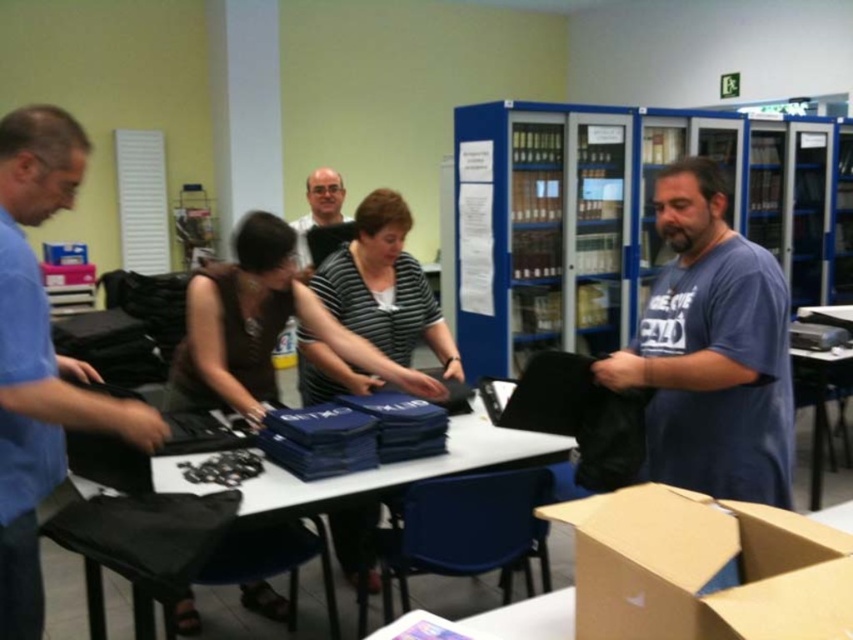
Question: Which of the following is the farthest from the observer?

Choices:
 (A) (821, 413)
 (B) (187, 285)
 (C) (744, 374)
 (D) (622, 156)

Answer: (D)

Question: Can you confirm if blue matte shirt at right is wider than matte black laptop at left?

Choices:
 (A) no
 (B) yes

Answer: (B)

Question: Does blue matte shirt at right have a larger size compared to black fabric table at center?

Choices:
 (A) no
 (B) yes

Answer: (A)

Question: Based on their relative distances, which object is farther from the black plastic table at center?

Choices:
 (A) blue plastic bookshelf at upper center
 (B) black fabric table at center
 (C) matte black laptop at upper center

Answer: (C)

Question: Is matte black laptop at left to the left of matte black shirt at center from the viewer's perspective?

Choices:
 (A) no
 (B) yes

Answer: (B)

Question: Among these points, which one is farthest from the camera?

Choices:
 (A) (210, 376)
 (B) (820, 497)
 (C) (730, 456)

Answer: (B)